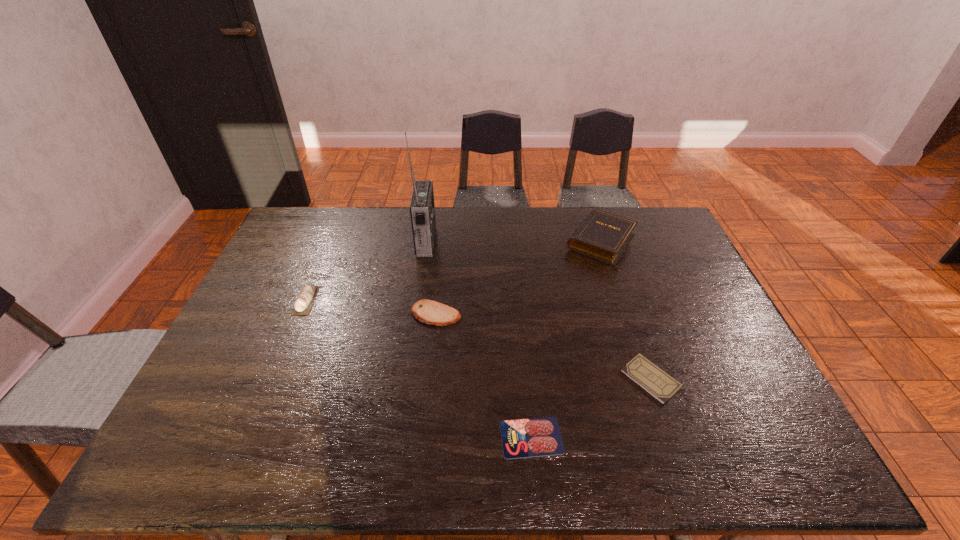
Image resolution: width=960 pixels, height=540 pixels. Find the location of `empty space between the checkbook and the shorter pita bread`. empty space between the checkbook and the shorter pita bread is located at coordinates (543, 347).

At what (x,y) coordinates should I click in order to perform the action: click on unoccupied position between the right pita bread and the fourth object from left to right. Please return your answer as a coordinate pair (x, y). The image size is (960, 540). Looking at the image, I should click on (484, 376).

The width and height of the screenshot is (960, 540). I want to click on free space between the left pita bread and the Bible, so click(453, 271).

Locate an element on the screen. The image size is (960, 540). vacant space that is in between the radio receiver and the right pita bread is located at coordinates (431, 278).

I want to click on unoccupied position between the fifth shortest object and the tallest object, so click(x=513, y=241).

Identify the location of free space between the taller pita bread and the tallest object. (366, 271).

In order to click on vacant area that lies between the second tallest object and the radio receiver in this screenshot , I will do `click(513, 241)`.

Locate an element on the screen. This screenshot has width=960, height=540. free spot between the checkbook and the nearest object is located at coordinates (591, 408).

Identify which object is the fourth closest to the Bible. Please provide its 2D coordinates. Your answer should be formatted as a tuple, i.e. [(x, y)], where the tuple contains the x and y coordinates of a point satisfying the conditions above.

[(522, 438)]

Identify which object is the fifth nearest to the second tallest object. Please provide its 2D coordinates. Your answer should be formatted as a tuple, i.e. [(x, y)], where the tuple contains the x and y coordinates of a point satisfying the conditions above.

[(303, 304)]